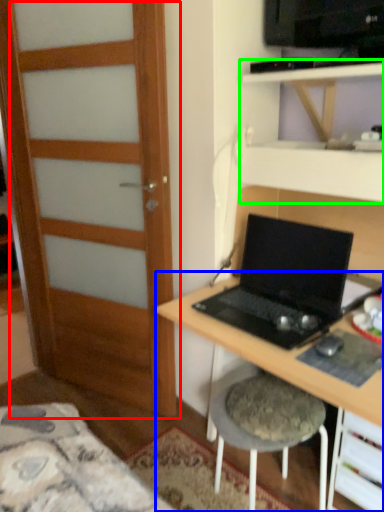
Question: Which object is the farthest from door (highlighted by a red box)? Choose among these: desk (highlighted by a blue box) or shelf (highlighted by a green box).

Choices:
 (A) desk
 (B) shelf

Answer: (B)